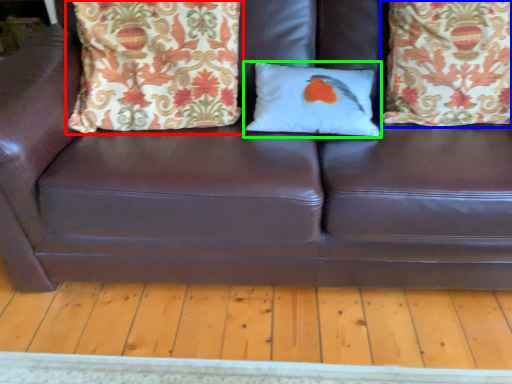
Question: Based on their relative distances, which object is farther from pillow (highlighted by a red box)? Choose from pillow (highlighted by a blue box) and pillow (highlighted by a green box).

Choices:
 (A) pillow
 (B) pillow

Answer: (A)